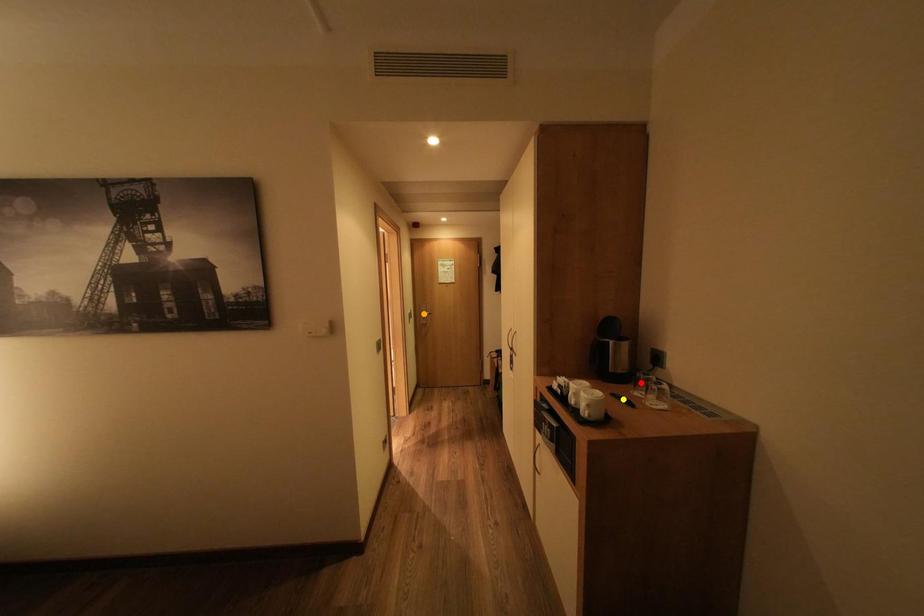
Order these from nearest to farthest:
red point
orange point
yellow point

yellow point < red point < orange point